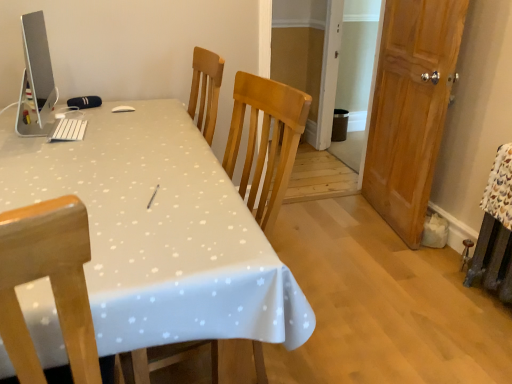
Question: Is white glossy table at center thinner than sleek silver monitor at upper left?

Choices:
 (A) yes
 (B) no

Answer: (B)

Question: From a real-world perspective, is white glossy table at center below sleek silver monitor at upper left?

Choices:
 (A) yes
 (B) no

Answer: (A)

Question: Does white glossy table at center appear on the left side of sleek silver monitor at upper left?

Choices:
 (A) yes
 (B) no

Answer: (B)

Question: Is there a large distance between white glossy table at center and sleek silver monitor at upper left?

Choices:
 (A) yes
 (B) no

Answer: (B)

Question: Considering the relative sizes of white glossy table at center and sleek silver monitor at upper left in the image provided, is white glossy table at center smaller than sleek silver monitor at upper left?

Choices:
 (A) yes
 (B) no

Answer: (B)

Question: Is white glossy table at center to the right of sleek silver monitor at upper left from the viewer's perspective?

Choices:
 (A) no
 (B) yes

Answer: (B)

Question: Is there a large distance between sleek silver monitor at upper left and wooden door at right?

Choices:
 (A) yes
 (B) no

Answer: (A)

Question: Considering the relative positions of sleek silver monitor at upper left and wooden door at right in the image provided, is sleek silver monitor at upper left to the left of wooden door at right from the viewer's perspective?

Choices:
 (A) no
 (B) yes

Answer: (B)

Question: Is sleek silver monitor at upper left positioned in front of wooden door at right?

Choices:
 (A) yes
 (B) no

Answer: (A)

Question: Does sleek silver monitor at upper left have a greater height compared to wooden door at right?

Choices:
 (A) no
 (B) yes

Answer: (A)

Question: From the image's perspective, is sleek silver monitor at upper left below wooden door at right?

Choices:
 (A) yes
 (B) no

Answer: (B)

Question: Considering the relative sizes of sleek silver monitor at upper left and wooden door at right in the image provided, is sleek silver monitor at upper left thinner than wooden door at right?

Choices:
 (A) yes
 (B) no

Answer: (A)

Question: From a real-world perspective, is wooden door at right positioned under sleek silver monitor at upper left based on gravity?

Choices:
 (A) no
 (B) yes

Answer: (B)